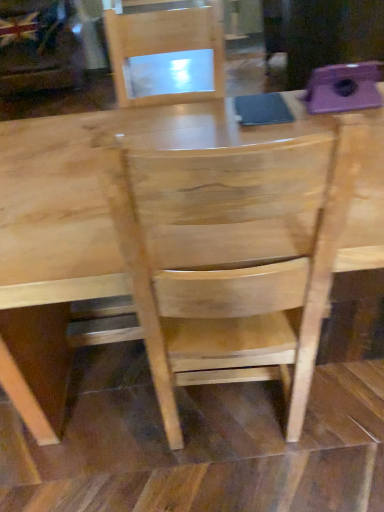
What is the approximate width of natural wood chair at center?

The width of natural wood chair at center is 21.69 inches.

Describe the element at coordinates (232, 269) in the screenshot. I see `natural wood chair at center` at that location.

Where is `natural wood chair at center`? This screenshot has width=384, height=512. natural wood chair at center is located at coordinates (232, 269).

Locate an element on the screen. Image resolution: width=384 pixels, height=512 pixels. natural wood chair at center is located at coordinates (232, 269).